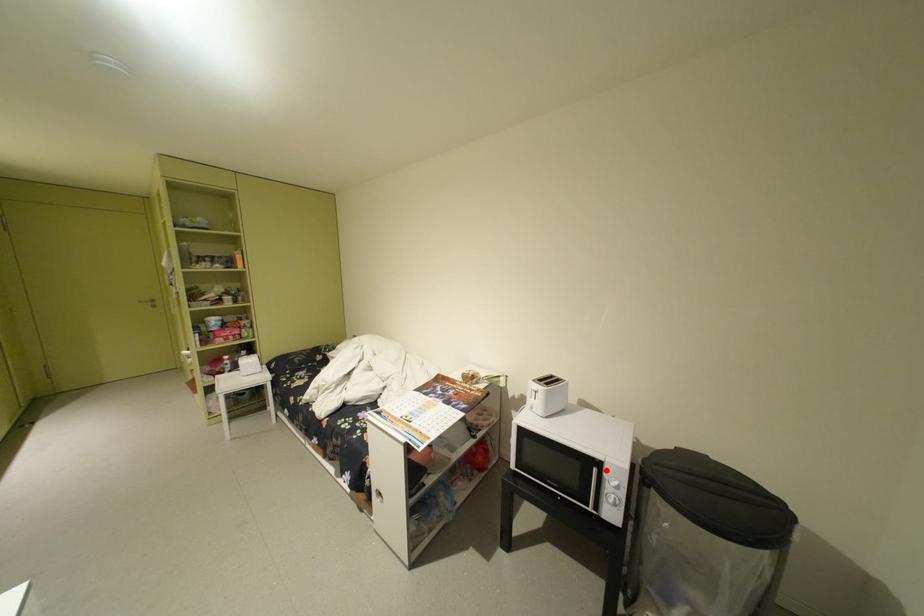
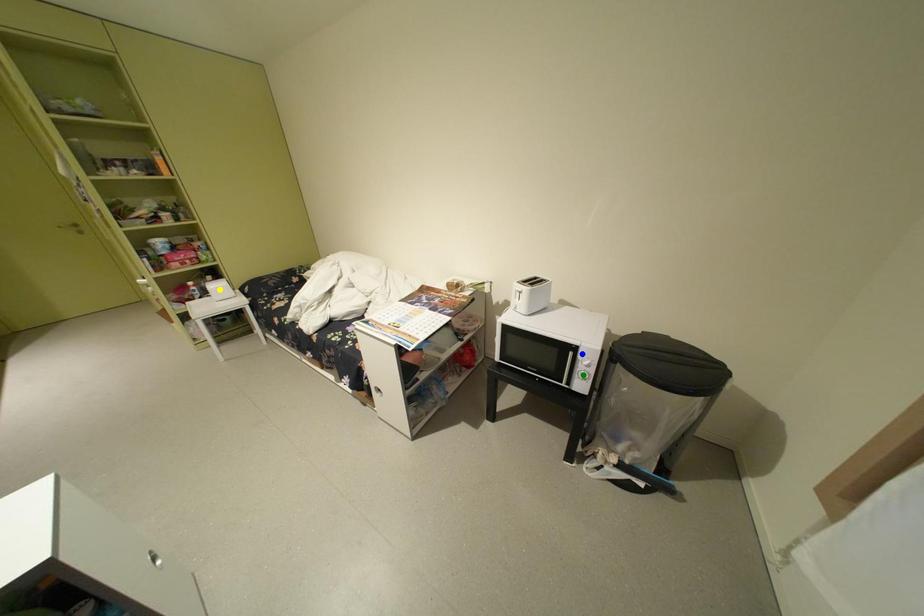
Question: I am providing you with two images of the same scene from different viewpoints. A red point is marked on the first image. You are given multiple points on the second image. In image 2, which mark is for the same physical point as the one in image 1?

Choices:
 (A) blue point
 (B) yellow point
 (C) green point

Answer: (A)